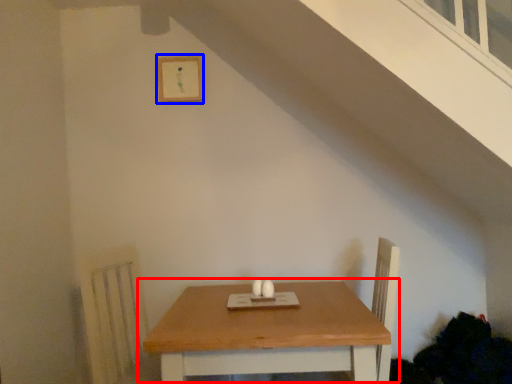
Question: Which object appears closest to the camera in this image, table (highlighted by a red box) or picture frame (highlighted by a blue box)?

Choices:
 (A) table
 (B) picture frame

Answer: (A)